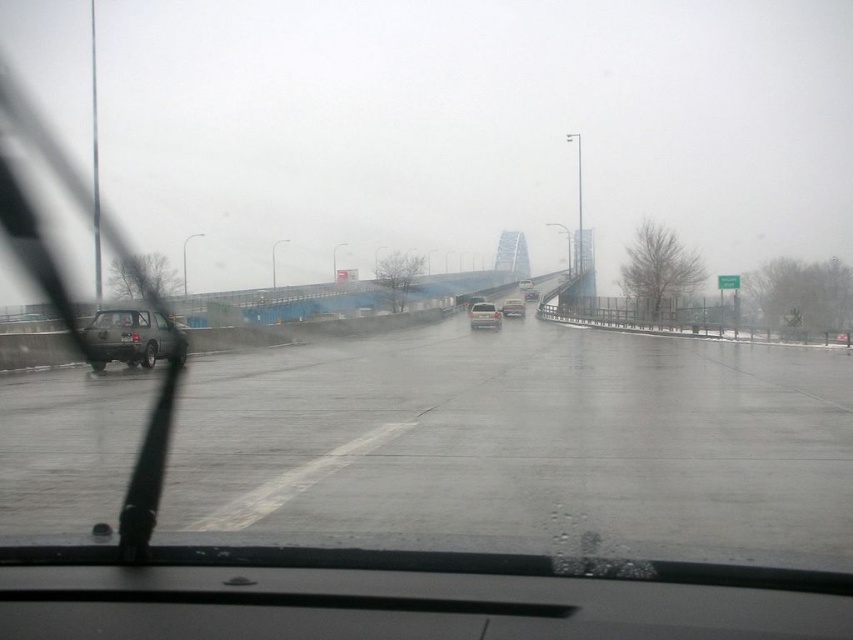
You are a passenger in a car and you see a matte gray sedan at left and a matte silver suv at center. Which vehicle is closer to the left side of the road?

The matte gray sedan at left is closer to the left side of the road because it is positioned to the left of the matte silver suv at center.

You are a passenger in a car and want to describe the road condition outside. Based on the image, what is the condition of the gray asphalt highway at left near point (521, 445)?

The gray asphalt highway at left near point (521, 445) is wet, as the pavement is reflective due to recent rain or drizzle.

You are driving a car and see the white matte van at center and the matte silver suv at center ahead on the road. If your car is 15 feet long, can you safely pass between them without hitting either vehicle?

The distance between the white matte van at center and the matte silver suv at center is 53.28 feet. Since your car is 15 feet long, there is enough space to safely pass between them as 53.28 feet is greater than 15 feet.